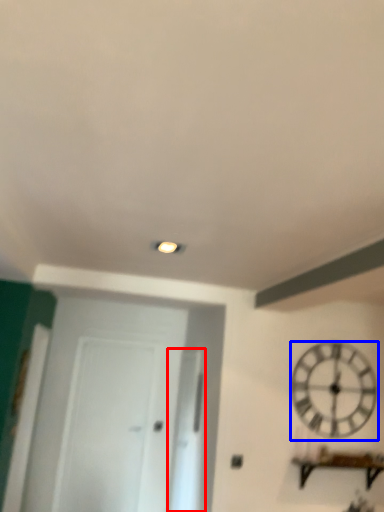
Question: Among these objects, which one is farthest to the camera, glass door (highlighted by a red box) or wall clock (highlighted by a blue box)?

Choices:
 (A) glass door
 (B) wall clock

Answer: (A)